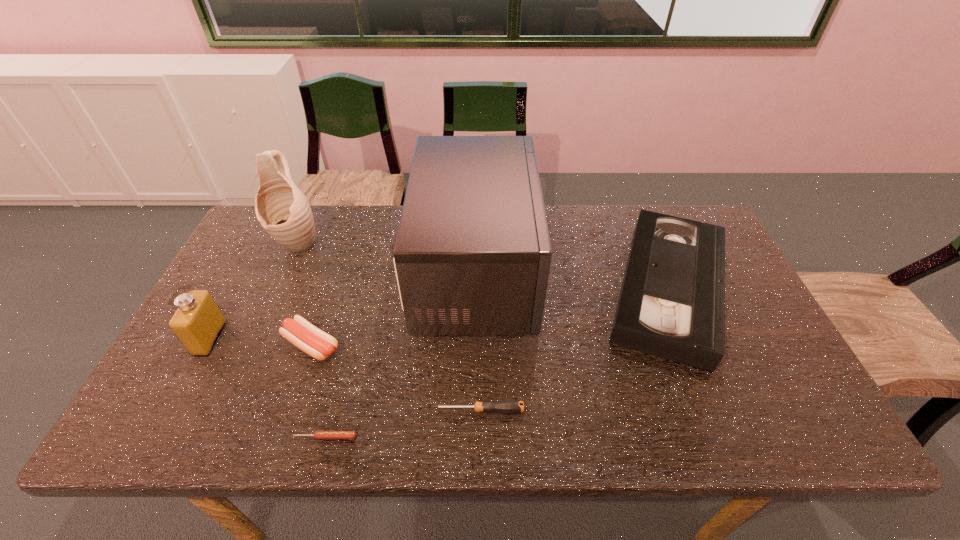
The image size is (960, 540). I want to click on microwave oven that is at the far edge, so click(472, 256).

Locate an element on the screen. videotape present at the far edge is located at coordinates (672, 301).

Image resolution: width=960 pixels, height=540 pixels. In order to click on screwdriver that is at the near edge in this screenshot , I will do `click(508, 406)`.

The height and width of the screenshot is (540, 960). I want to click on sausage that is at the near edge, so click(x=319, y=434).

At what (x,y) coordinates should I click in order to perform the action: click on pitcher at the left edge. Please return your answer as a coordinate pair (x, y). This screenshot has width=960, height=540. Looking at the image, I should click on (282, 209).

The height and width of the screenshot is (540, 960). Find the location of `perfume present at the left edge`. perfume present at the left edge is located at coordinates (198, 322).

The width and height of the screenshot is (960, 540). What are the coordinates of `object located at the right edge` in the screenshot? It's located at (672, 301).

The image size is (960, 540). I want to click on object that is at the far left corner, so [x=282, y=209].

Identify the location of object at the far right corner. (672, 301).

This screenshot has width=960, height=540. In order to click on free space at the far edge of the desktop in this screenshot , I will do `click(567, 237)`.